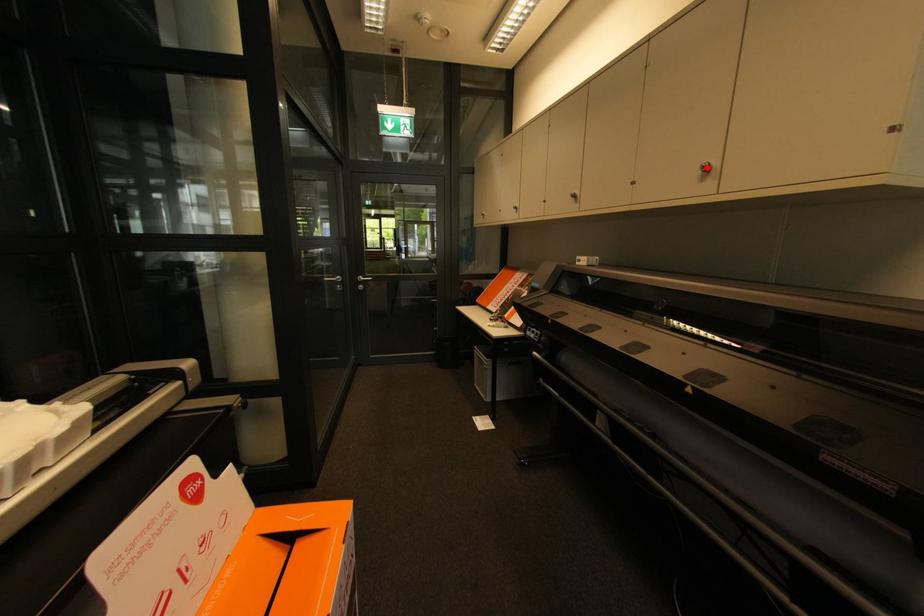
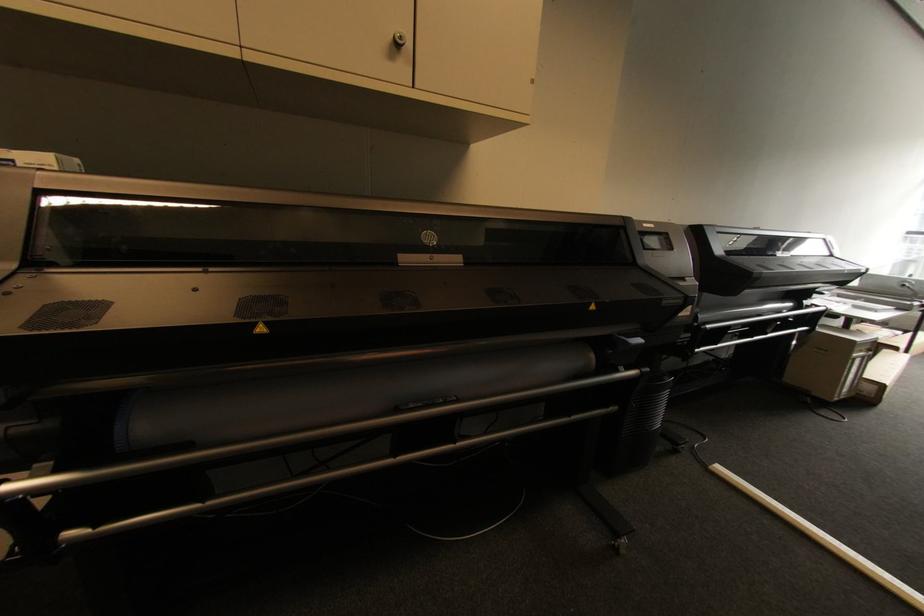
The point at the highlighted location is marked in the first image. Where is the corresponding point in the second image?

(405, 38)